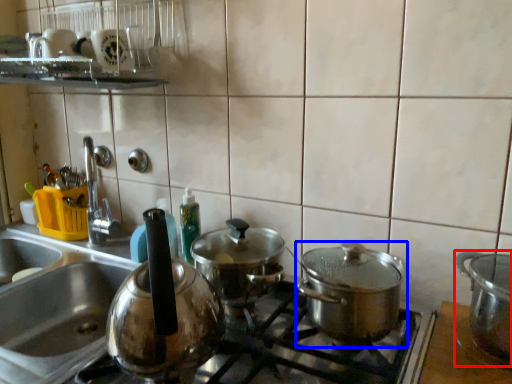
Question: Which object is further to the camera taking this photo, kitchen appliance (highlighted by a red box) or kitchen appliance (highlighted by a blue box)?

Choices:
 (A) kitchen appliance
 (B) kitchen appliance

Answer: (A)